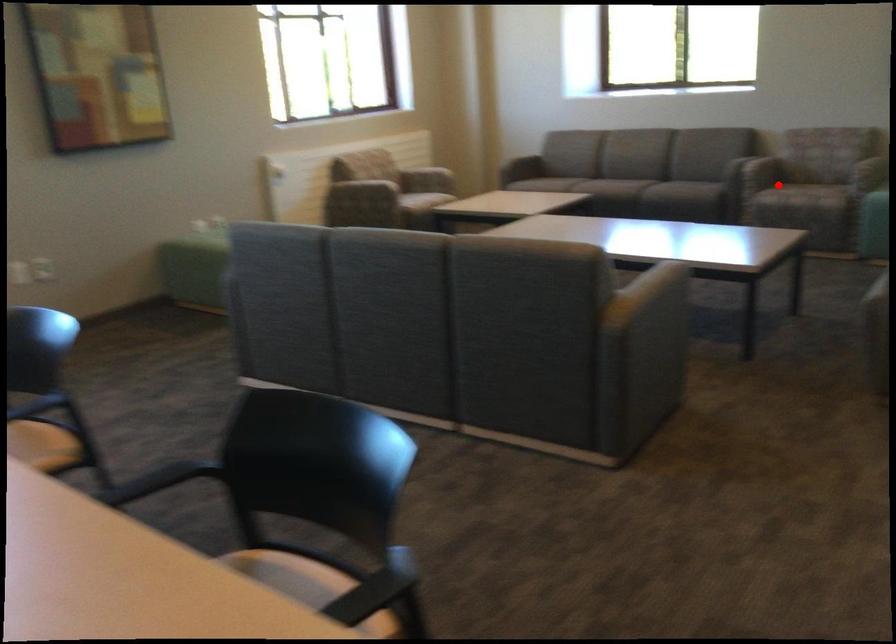
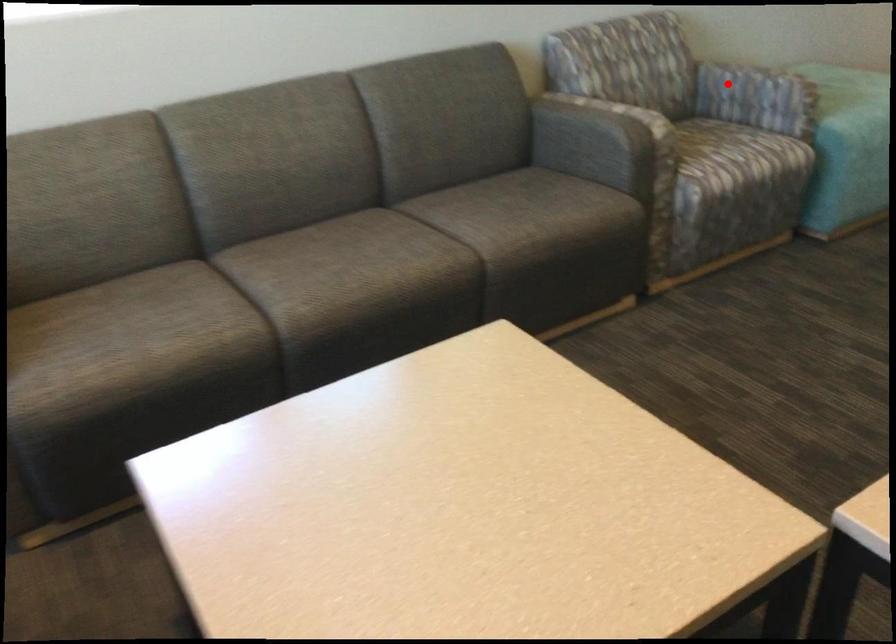
I am providing you with two images of the same scene from different viewpoints. A red point is marked on the first image and another point is marked on the second image. Is the red point in image1 aligned with the point shown in image2?

No